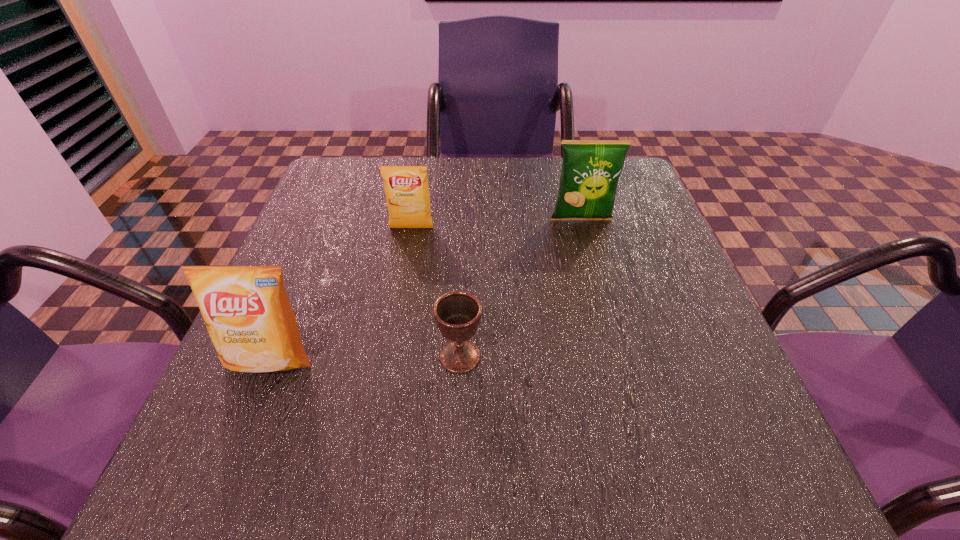
Find the location of a particular element. This screenshot has width=960, height=540. unoccupied position between the rightmost crisp (potato chip) and the leftmost object is located at coordinates (426, 290).

Where is `vacant region between the second crisp (potato chip) from right to left and the leftmost object`? vacant region between the second crisp (potato chip) from right to left and the leftmost object is located at coordinates (341, 294).

The width and height of the screenshot is (960, 540). In order to click on empty space that is in between the second crisp (potato chip) from left to right and the chalice in this screenshot , I will do `click(436, 292)`.

What are the coordinates of `empty space that is in between the third object from right to left and the rightmost object` in the screenshot? It's located at (496, 224).

What are the coordinates of `free space that is in between the third tallest object and the rightmost crisp (potato chip)` in the screenshot? It's located at (496, 224).

This screenshot has height=540, width=960. In order to click on vacant space that's between the rightmost object and the nearest crisp (potato chip) in this screenshot , I will do `click(426, 290)`.

You are a GUI agent. You are given a task and a screenshot of the screen. Output one action in this format:
    pyautogui.click(x=<x>, y=<y>)
    Task: Click on the free space that is in between the second shortest object and the rightmost object
    
    Given the screenshot: What is the action you would take?
    pyautogui.click(x=496, y=224)

Image resolution: width=960 pixels, height=540 pixels. I want to click on unoccupied area between the leftmost crisp (potato chip) and the rightmost object, so click(x=426, y=290).

Locate an element on the screen. empty location between the second object from left to right and the rightmost crisp (potato chip) is located at coordinates (496, 224).

The width and height of the screenshot is (960, 540). Identify the location of object that is the third closest to the third tallest object. (246, 310).